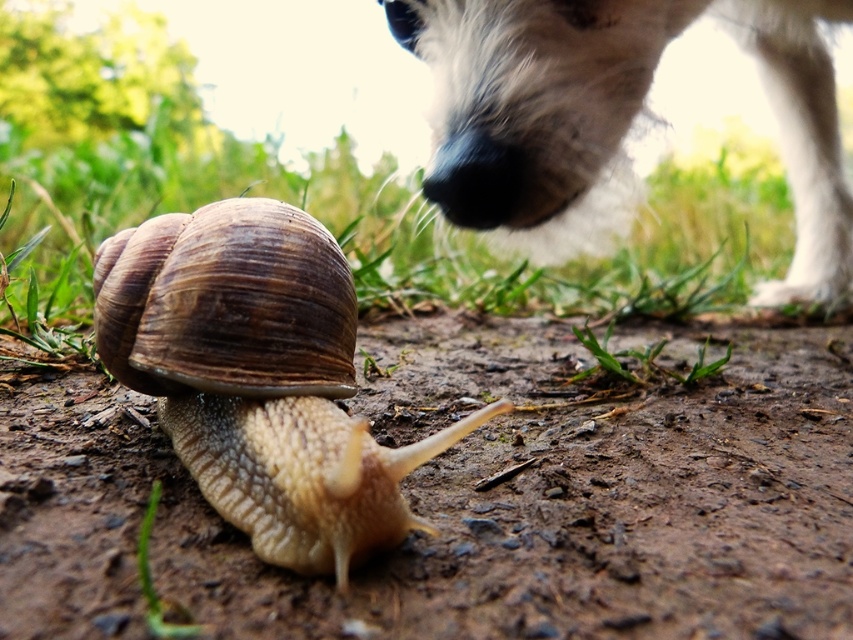
You are a photographer trying to capture the snail in the image. The snail is located at point (258, 376). Can you confirm if this point is where the brown textured shell is located?

Yes, the point (258, 376) marks the brown textured shell at center, so the snail is indeed located there.

You are a photographer trying to capture a close shot of the green grass at lower left and the white fluffy dog at upper right. Which object is nearer to your camera lens?

The green grass at lower left is closer to the viewer than the white fluffy dog at upper right, so the green grass at lower left would be nearer to the camera lens.

You are a photographer trying to focus on two points in the image. The first point is at coordinates point [247,296] and the second is at point [474,160]. Which point should you focus on to capture the foreground element clearly?

Point [247,296] is closer to the camera than point [474,160], so focusing on point [247,296] will capture the foreground element clearly.